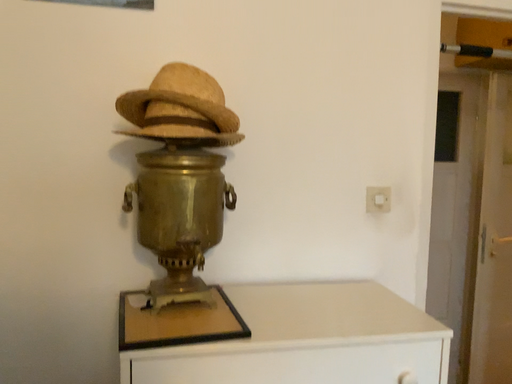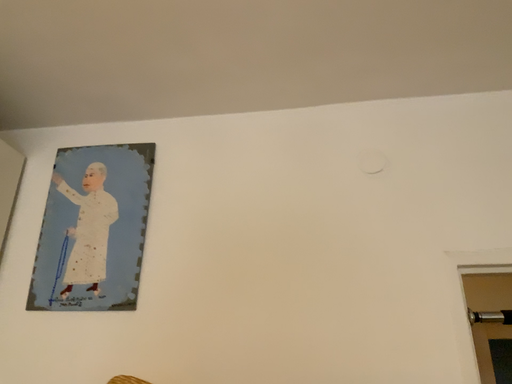
Question: Which way did the camera rotate in the video?

Choices:
 (A) rotated right
 (B) rotated left

Answer: (B)